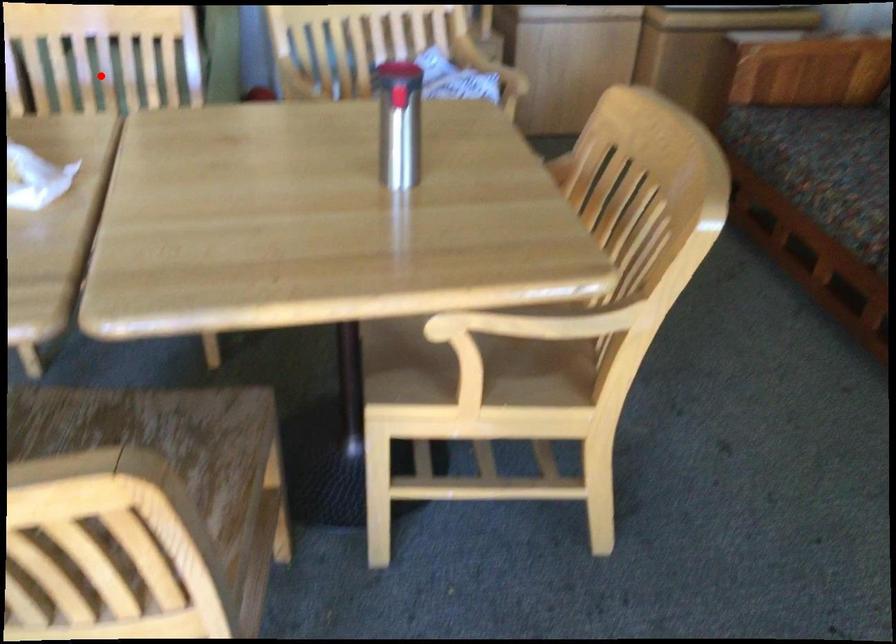
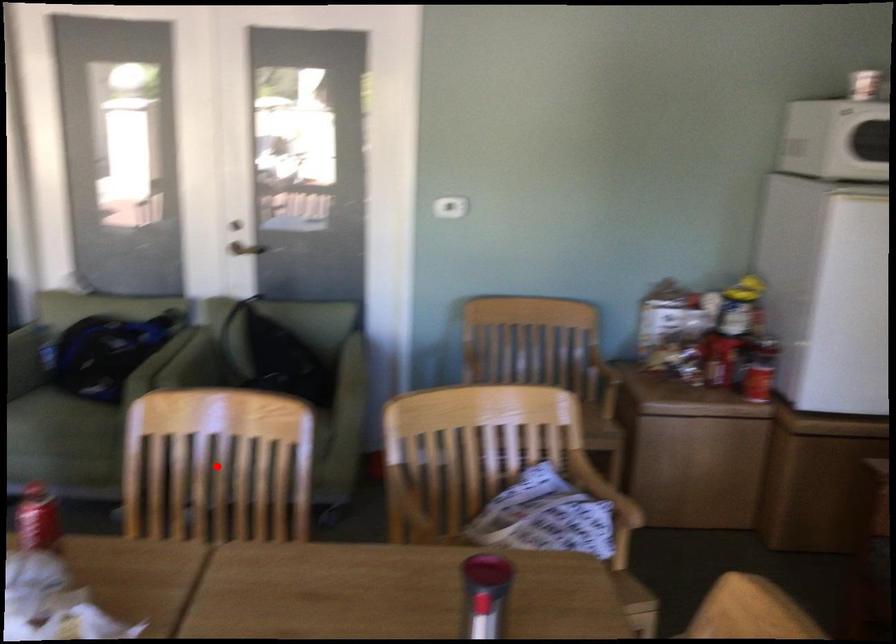
I am providing you with two images of the same scene from different viewpoints. A red point is marked on the first image and another point is marked on the second image. Is the marked point in image1 the same physical position as the marked point in image2?

Yes